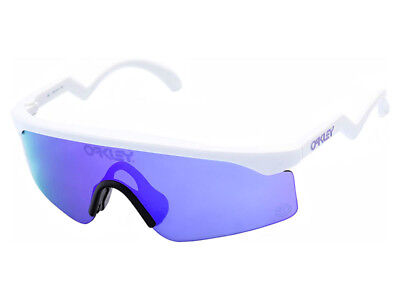
The image size is (400, 300). Find the location of `text inside frame`. text inside frame is located at coordinates (55, 93).